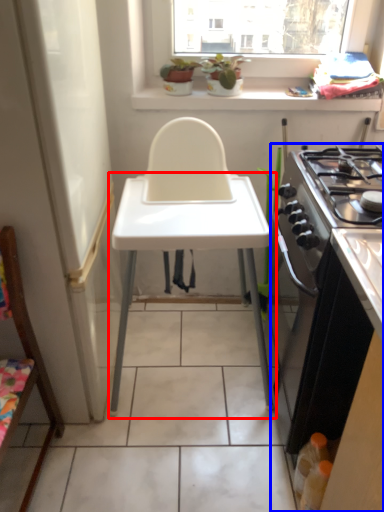
Question: Which object appears closest to the camera in this image, changing table (highlighted by a red box) or cabinetry (highlighted by a blue box)?

Choices:
 (A) changing table
 (B) cabinetry

Answer: (B)